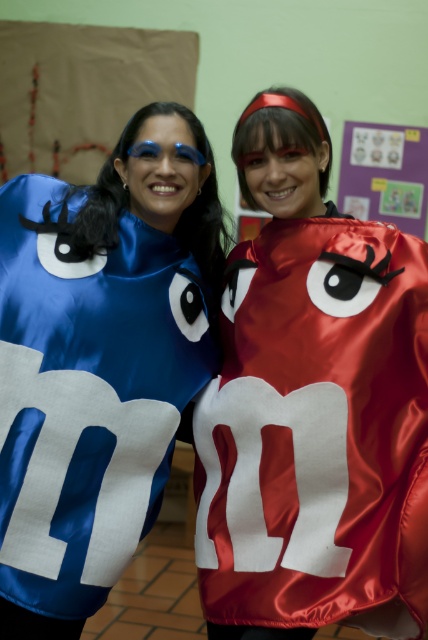
Is point (299, 273) positioned behind point (9, 637)?

Yes, it is behind point (9, 637).

Is satin shiny m&m at center smaller than satin blue m&m at left?

Actually, satin shiny m&m at center might be larger than satin blue m&m at left.

Describe the element at coordinates (312, 404) in the screenshot. The height and width of the screenshot is (640, 428). I see `satin shiny m&m at center` at that location.

Find the location of `satin shiny m&m at center`. satin shiny m&m at center is located at coordinates (312, 404).